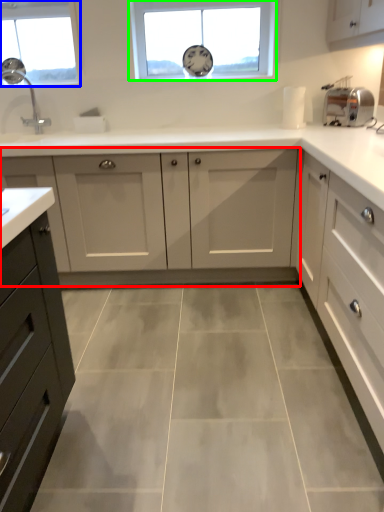
Question: Considering the real-world distances, which object is farthest from cabinetry (highlighted by a red box)? window (highlighted by a blue box) or window (highlighted by a green box)?

Choices:
 (A) window
 (B) window

Answer: (A)